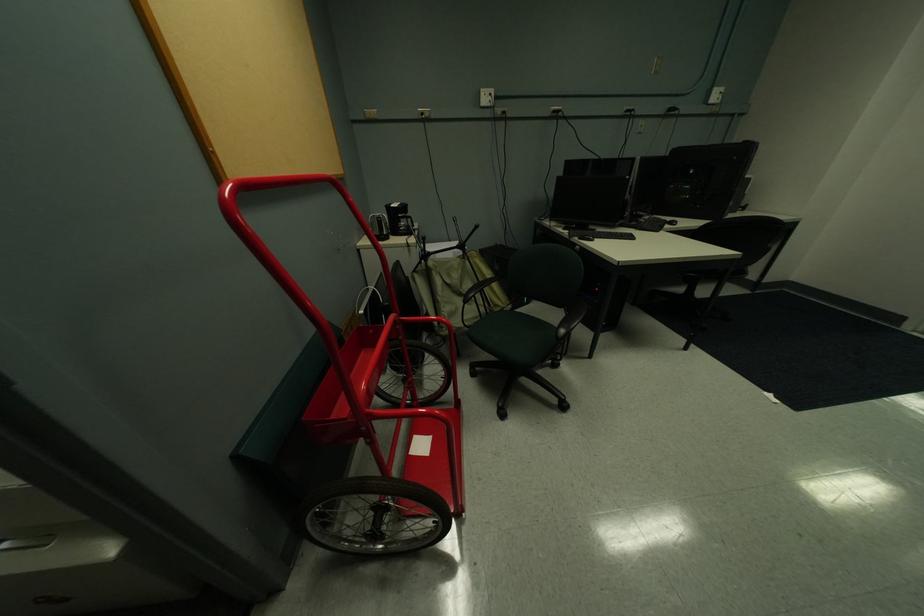
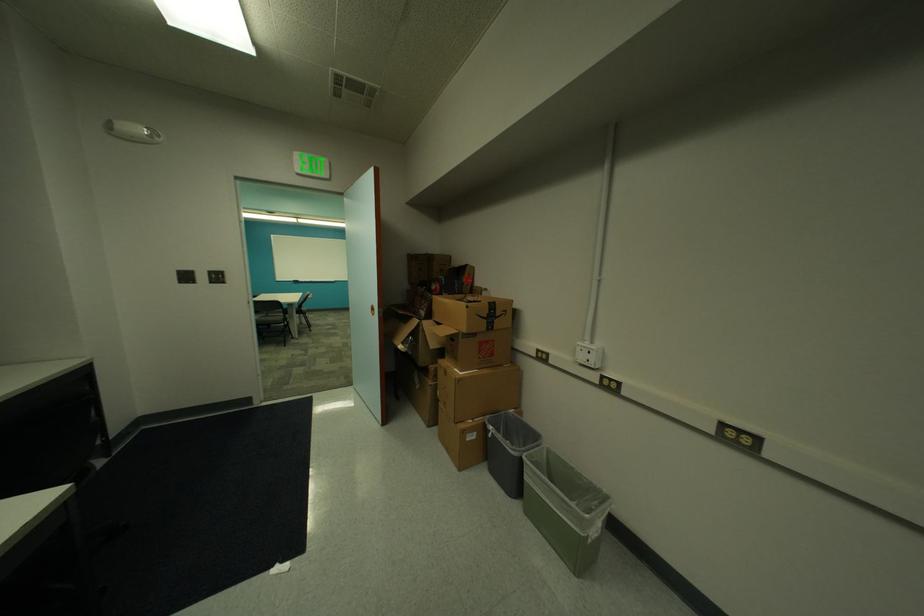
Based on the photo, the images are taken continuously from a first-person perspective. In which direction is your viewpoint rotating?

The rotation direction of the camera is right-down.